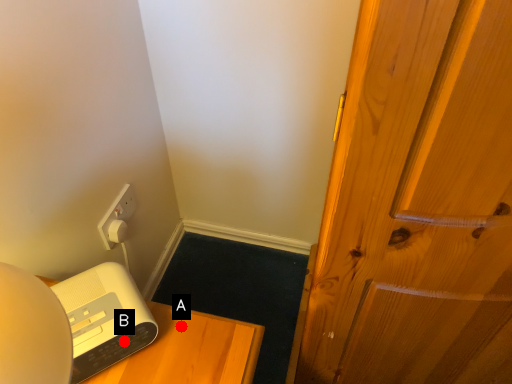
Question: Two points are circled on the image, labeled by A and B beside each circle. Which of the following is the closest to the observer?

Choices:
 (A) A is closer
 (B) B is closer

Answer: (B)